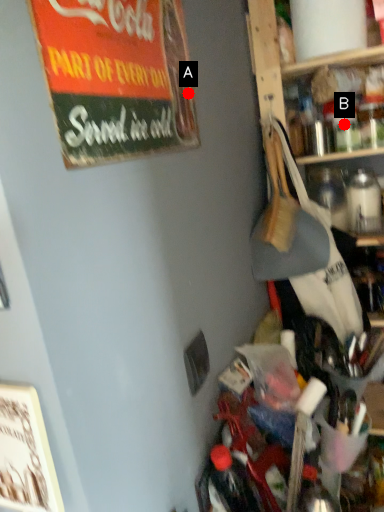
Question: Two points are circled on the image, labeled by A and B beside each circle. Which point is farther from the camera taking this photo?

Choices:
 (A) A is further
 (B) B is further

Answer: (B)